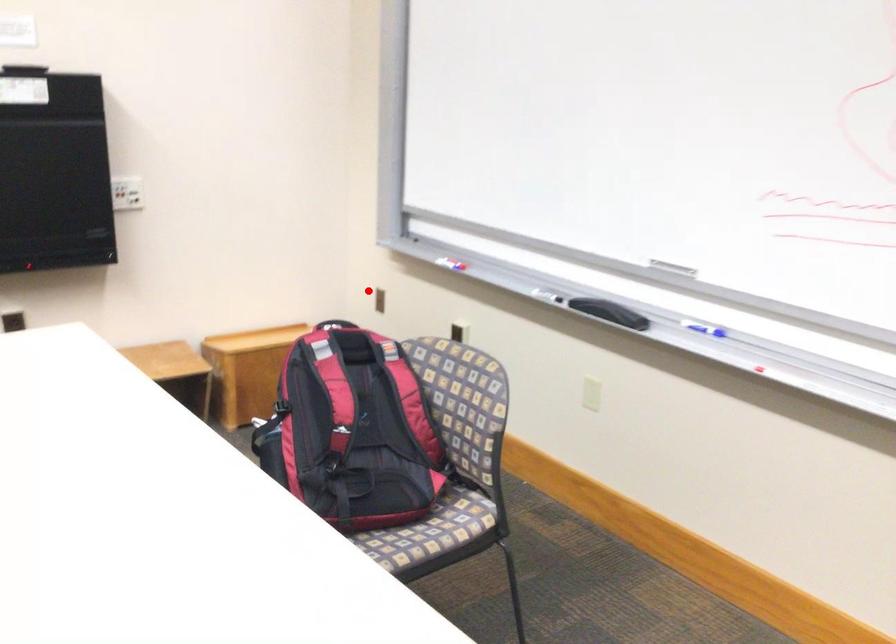
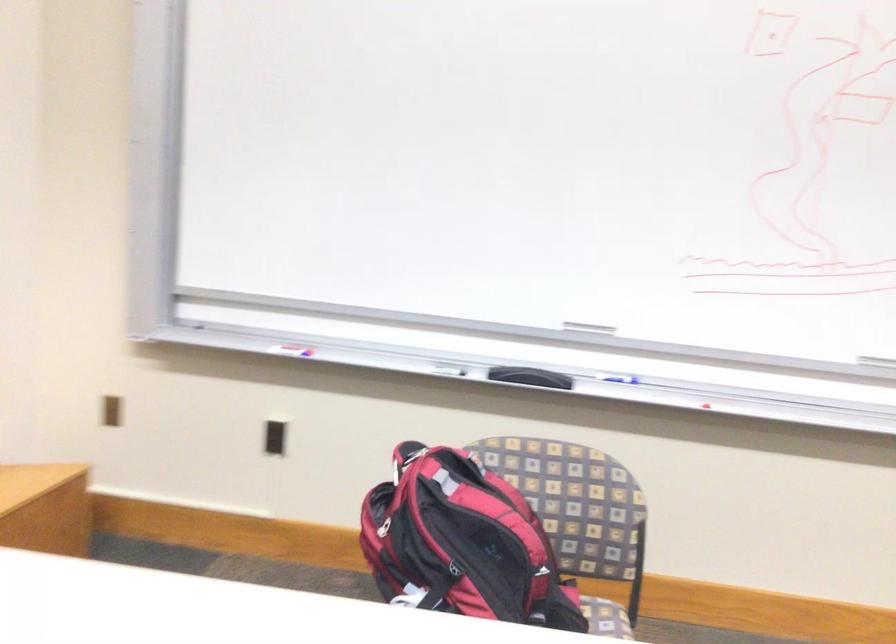
Question: I am providing you with two images of the same scene from different viewpoints. A red point is marked on the first image. Is the red point's position out of view in image 2?

Choices:
 (A) Yes
 (B) No

Answer: (B)